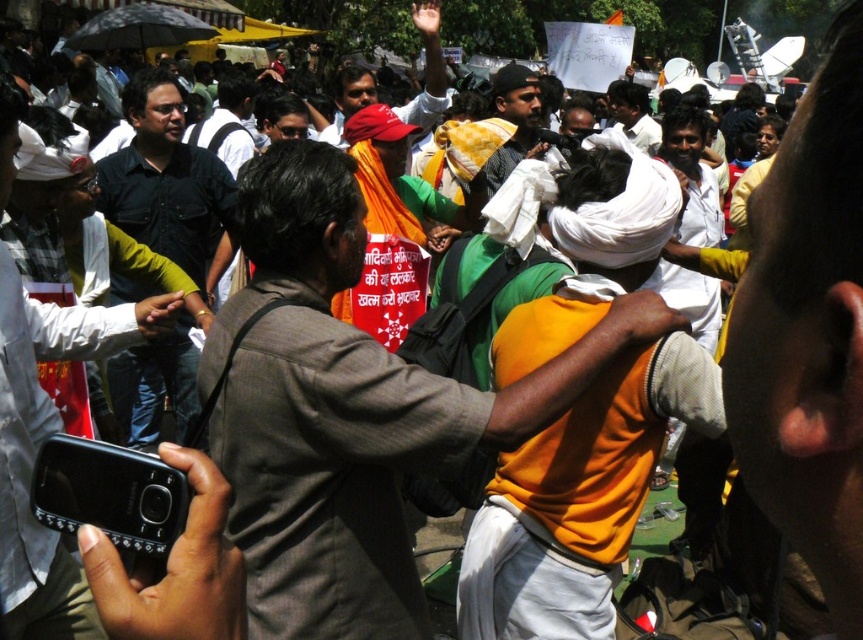
Question: Can you confirm if dark blue shirt at center is positioned below orange fabric cloth at center?

Choices:
 (A) yes
 (B) no

Answer: (A)

Question: Does orange fabric shirt at center have a larger size compared to matte black shirt at left?

Choices:
 (A) no
 (B) yes

Answer: (B)

Question: Which point is farther from the camera taking this photo?

Choices:
 (A) (313, 147)
 (B) (784, 134)
 (C) (66, 600)

Answer: (B)

Question: Which object is closer to the camera taking this photo?

Choices:
 (A) matte black phone at center
 (B) orange fabric cloth at center

Answer: (A)

Question: Does orange fabric shirt at center come in front of orange fabric cloth at center?

Choices:
 (A) no
 (B) yes

Answer: (B)

Question: Among these objects, which one is farthest from the camera?

Choices:
 (A) orange fabric cloth at center
 (B) matte black phone at center
 (C) matte black shirt at left
 (D) orange fabric shirt at center

Answer: (A)